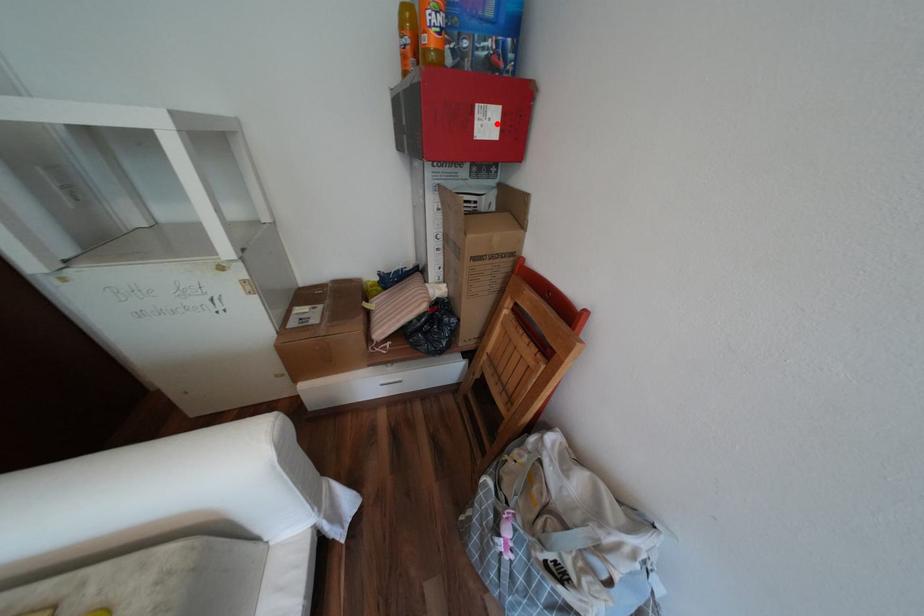
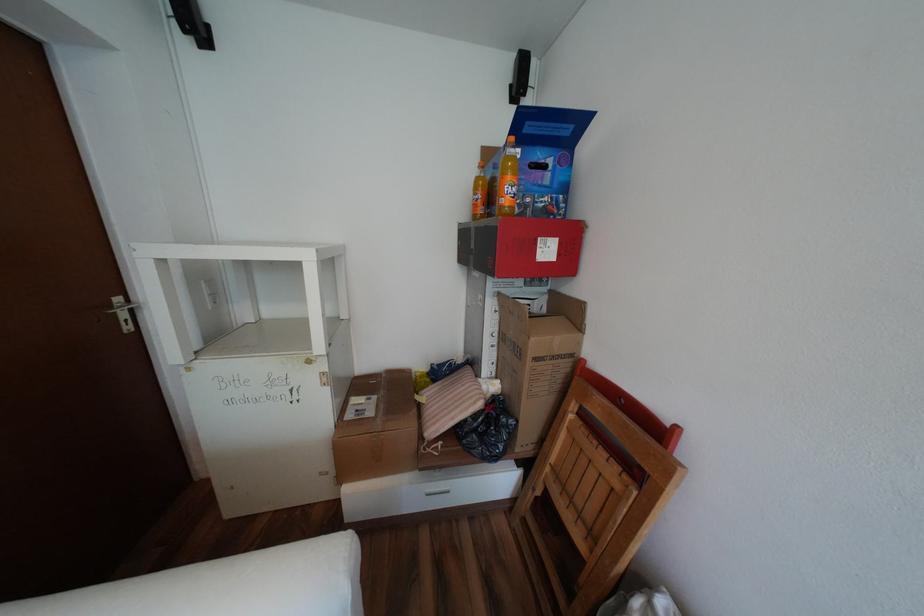
Find the pixel in the second image that matches the highlighted location in the first image.

(556, 251)